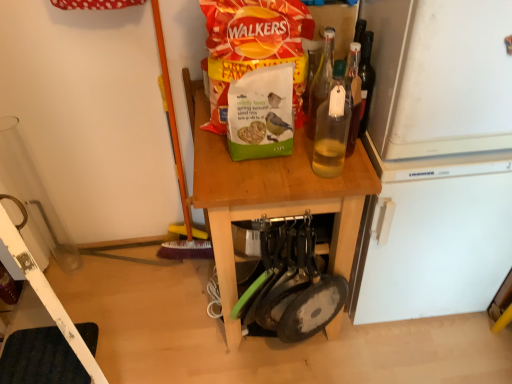
Question: Is green matte birdseed packet at center bigger than wooden table at center?

Choices:
 (A) yes
 (B) no

Answer: (B)

Question: From the image's perspective, would you say green matte birdseed packet at center is positioned over wooden table at center?

Choices:
 (A) yes
 (B) no

Answer: (A)

Question: Is green matte birdseed packet at center positioned beyond the bounds of wooden table at center?

Choices:
 (A) no
 (B) yes

Answer: (B)

Question: Would you say green matte birdseed packet at center is a long distance from wooden table at center?

Choices:
 (A) no
 (B) yes

Answer: (A)

Question: Is green matte birdseed packet at center turned away from wooden table at center?

Choices:
 (A) no
 (B) yes

Answer: (A)

Question: Is green matte birdseed packet at center inside the boundaries of wooden table at center, or outside?

Choices:
 (A) inside
 (B) outside

Answer: (B)

Question: Is point (239, 1) closer or farther from the camera than point (296, 158)?

Choices:
 (A) closer
 (B) farther

Answer: (A)

Question: From the image's perspective, is green matte birdseed packet at center positioned above or below wooden table at center?

Choices:
 (A) below
 (B) above

Answer: (B)

Question: From a real-world perspective, relative to wooden table at center, is green matte birdseed packet at center vertically above or below?

Choices:
 (A) above
 (B) below

Answer: (A)

Question: Is wooden table at center inside or outside of transparent glass bottle at center, the second bottle when ordered from back to front?

Choices:
 (A) outside
 (B) inside

Answer: (A)

Question: Considering the positions of wooden table at center and transparent glass bottle at center, the second bottle when ordered from back to front, in the image, is wooden table at center bigger or smaller than transparent glass bottle at center, the second bottle when ordered from back to front,?

Choices:
 (A) small
 (B) big

Answer: (B)

Question: From a real-world perspective, is wooden table at center above or below transparent glass bottle at center, which appears as the first bottle when viewed from the front?

Choices:
 (A) below
 (B) above

Answer: (A)

Question: Relative to transparent glass bottle at center, the second bottle when ordered from back to front, is wooden table at center in front or behind?

Choices:
 (A) front
 (B) behind

Answer: (B)

Question: Is point (237, 48) closer or farther from the camera than point (350, 109)?

Choices:
 (A) closer
 (B) farther

Answer: (B)

Question: From a real-world perspective, is green matte birdseed packet at center above or below transparent glass bottle at center, the second bottle when ordered from back to front?

Choices:
 (A) above
 (B) below

Answer: (A)